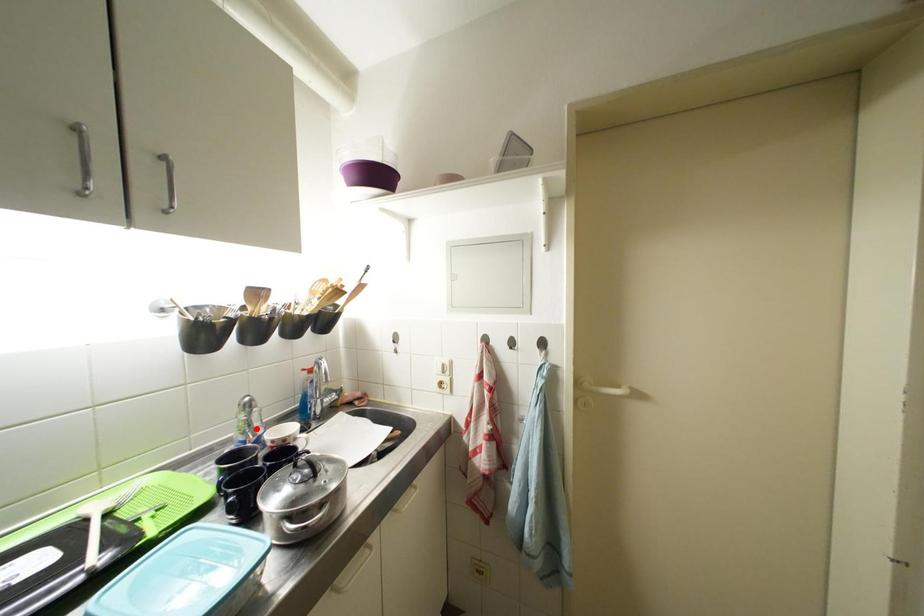
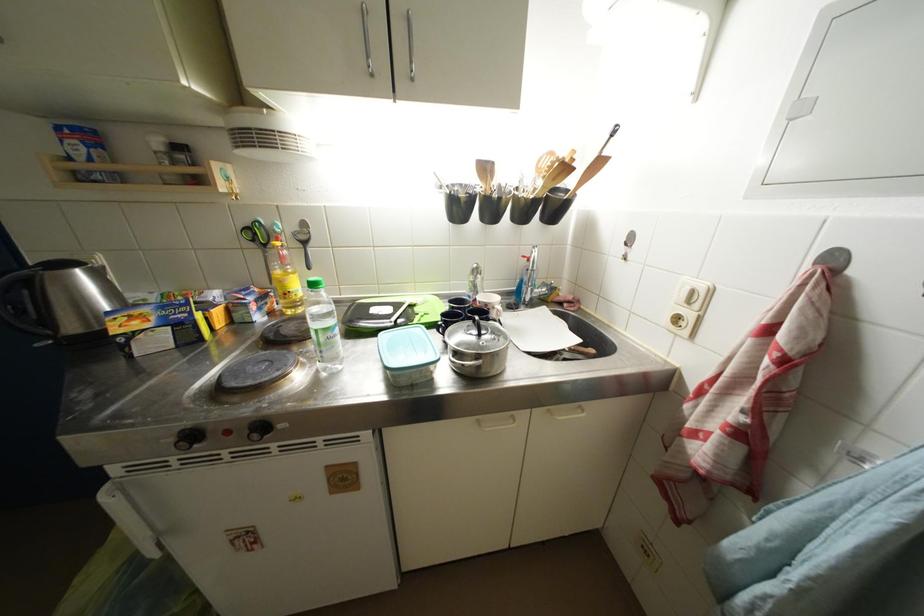
The point at the highlighted location is marked in the first image. Where is the corresponding point in the second image?

(481, 291)